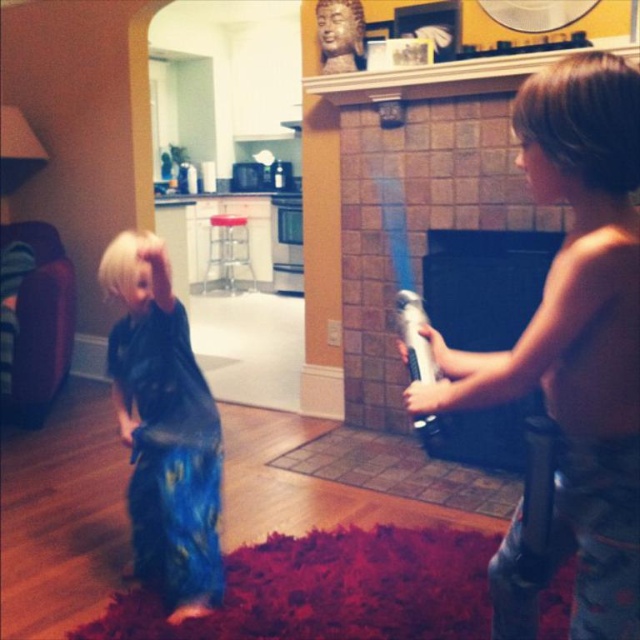
You are a photographer trying to capture a photo of the blue sequined skirt at lower left and the black brick fireplace at center. Which object should you focus on first if you want to ensure both are in focus without moving the camera?

The blue sequined skirt at lower left is located below the black brick fireplace at center. Since the fireplace is higher up, focusing on it first might help keep both in focus as the skirt is positioned lower in the frame.

You are a photographer standing in the center of the living room. You want to take a photo of both the point at (140,412) and the point at (458,259) without any obstructions. Based on their positions, which point should you focus on first to ensure both are in the frame?

You should focus on point (140,412) first since it is in front of point (458,259), ensuring both are visible in the frame without obstruction.

You are standing at the origin point in the living room. The blue sequined skirt at lower left is located at coordinates point (164, 429). If you want to move towards the blue sequined skirt at lower left, which direction should you move?

The point (164, 429) is located at the lower left, so you should move towards the lower left direction to reach the blue sequined skirt at lower left.